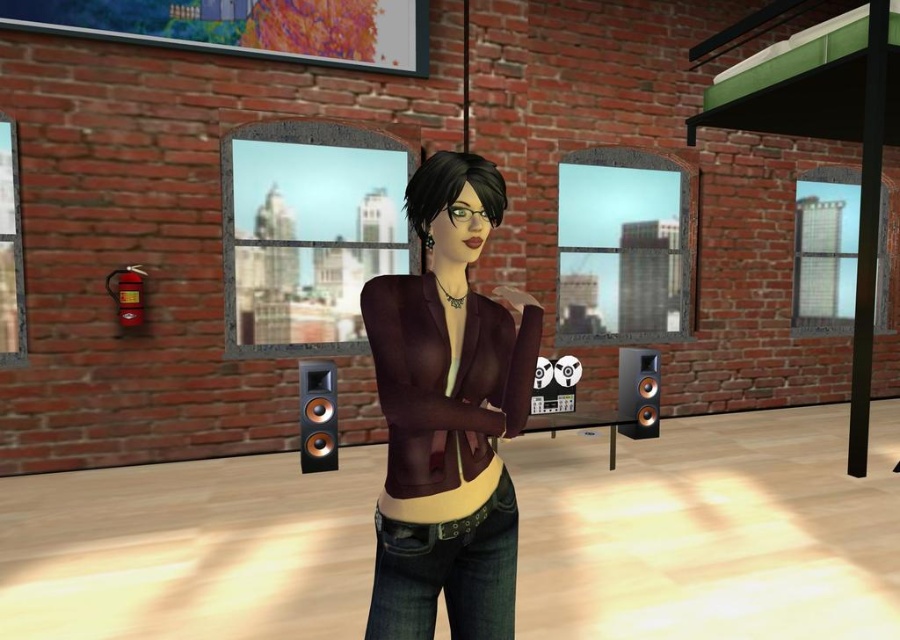
Question: Does matte brown blazer at center have a larger size compared to glass window at center?

Choices:
 (A) no
 (B) yes

Answer: (A)

Question: Which of these objects is positioned closest to the matte brown blazer at center?

Choices:
 (A) black wood speaker at lower left
 (B) polished wood speaker at right
 (C) denim jeans at center
 (D) glass window at center

Answer: (C)

Question: Which point is closer to the camera taking this photo?

Choices:
 (A) (454, 618)
 (B) (664, 204)

Answer: (A)

Question: Does glass window at center have a larger size compared to denim jeans at center?

Choices:
 (A) no
 (B) yes

Answer: (B)

Question: Which point is closer to the camera?

Choices:
 (A) (678, 186)
 (B) (632, 371)
 (C) (308, 128)
 (D) (447, 212)

Answer: (D)

Question: Is matte brown blazer at center positioned before denim jeans at center?

Choices:
 (A) no
 (B) yes

Answer: (B)